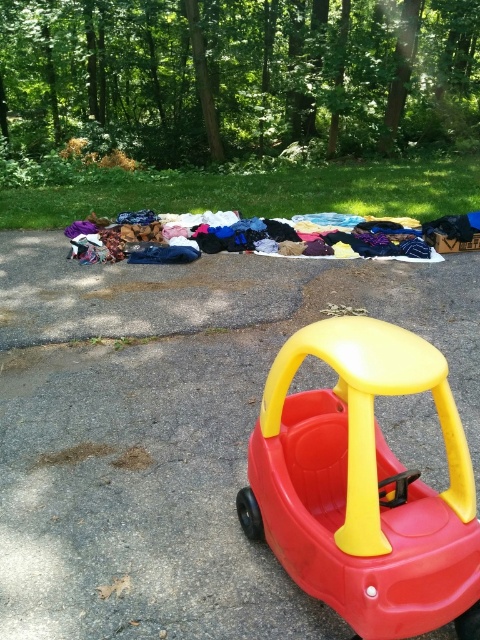
Is red plastic toy car at lower right to the left of matte plastic toy car at center from the viewer's perspective?

Correct, you'll find red plastic toy car at lower right to the left of matte plastic toy car at center.

Is point (218, 269) positioned after point (298, 362)?

Yes, point (218, 269) is behind point (298, 362).

Locate an element on the screen. The image size is (480, 640). red plastic toy car at lower right is located at coordinates (170, 429).

Is matte plastic toy car at center positioned behind multicolored fabric at center?

No, it is not.

Image resolution: width=480 pixels, height=640 pixels. What do you see at coordinates (363, 484) in the screenshot?
I see `matte plastic toy car at center` at bounding box center [363, 484].

Find the location of a particular element. The height and width of the screenshot is (640, 480). matte plastic toy car at center is located at coordinates (363, 484).

In the scene shown: Between red plastic toy car at lower right and multicolored fabric at center, which one appears on the left side from the viewer's perspective?

Positioned to the left is multicolored fabric at center.

From the picture: Is red plastic toy car at lower right further to the viewer compared to multicolored fabric at center?

No.

The height and width of the screenshot is (640, 480). What are the coordinates of `red plastic toy car at lower right` in the screenshot? It's located at (170, 429).

This screenshot has width=480, height=640. I want to click on red plastic toy car at lower right, so click(x=170, y=429).